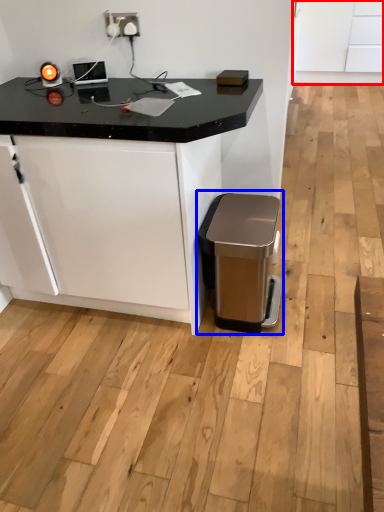
Question: Which point is further to the camera, cabinetry (highlighted by a red box) or waste container (highlighted by a blue box)?

Choices:
 (A) cabinetry
 (B) waste container

Answer: (A)